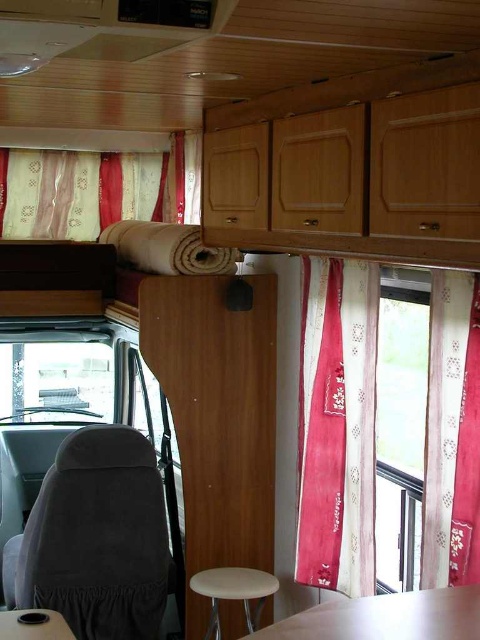
Can you confirm if pink fabric curtain at right is taller than pink fabric curtain at center?

Correct, pink fabric curtain at right is much taller as pink fabric curtain at center.

Can you confirm if pink fabric curtain at right is positioned below pink fabric curtain at center?

Yes, pink fabric curtain at right is below pink fabric curtain at center.

Is point (338, 305) positioned in front of point (345, 547)?

Yes, point (338, 305) is in front of point (345, 547).

Locate an element on the screen. pink fabric curtain at right is located at coordinates (337, 422).

Between gray fabric chair at lower left and white glossy table at lower center, which one appears on the right side from the viewer's perspective?

From the viewer's perspective, white glossy table at lower center appears more on the right side.

Looking at this image, between gray fabric chair at lower left and white glossy table at lower center, which one has less height?

Standing shorter between the two is white glossy table at lower center.

Locate an element on the screen. gray fabric chair at lower left is located at coordinates (96, 538).

Where is `gray fabric chair at lower left`? gray fabric chair at lower left is located at coordinates (96, 538).

Between white glossy table at lower center and transparent glass window at left, which one appears on the right side from the viewer's perspective?

From the viewer's perspective, white glossy table at lower center appears more on the right side.

Which is in front, point (436, 609) or point (82, 400)?

Positioned in front is point (436, 609).

At what (x,y) coordinates should I click in order to perform the action: click on white glossy table at lower center. Please return your answer as a coordinate pair (x, y). The width and height of the screenshot is (480, 640). Looking at the image, I should click on (385, 618).